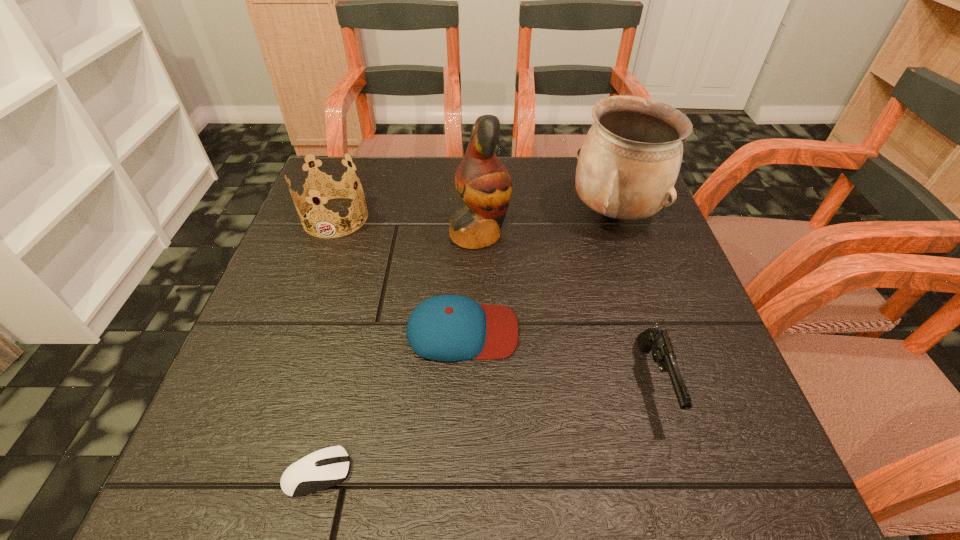
I want to click on parrot, so click(x=483, y=183).

Where is `urn`? urn is located at coordinates (628, 164).

This screenshot has height=540, width=960. I want to click on crown, so [326, 187].

Identify the location of gun. (663, 354).

Where is `baseball cap`? baseball cap is located at coordinates (450, 328).

You are a GUI agent. You are given a task and a screenshot of the screen. Output one action in this format:
    pyautogui.click(x=<x>, y=<y>)
    Task: Click on the shortest object
    The image size is (960, 540).
    Given the screenshot: What is the action you would take?
    pyautogui.click(x=321, y=469)

Identify the location of the nearest object. This screenshot has height=540, width=960. (321, 469).

Locate an element on the screen. The width and height of the screenshot is (960, 540). free spot located on the face of the parrot is located at coordinates (617, 234).

Locate an element on the screen. Image resolution: width=960 pixels, height=540 pixels. vacant space situated on the back of the urn is located at coordinates (596, 160).

Locate an element on the screen. Image resolution: width=960 pixels, height=540 pixels. vacant space situated on the back of the crown is located at coordinates (348, 183).